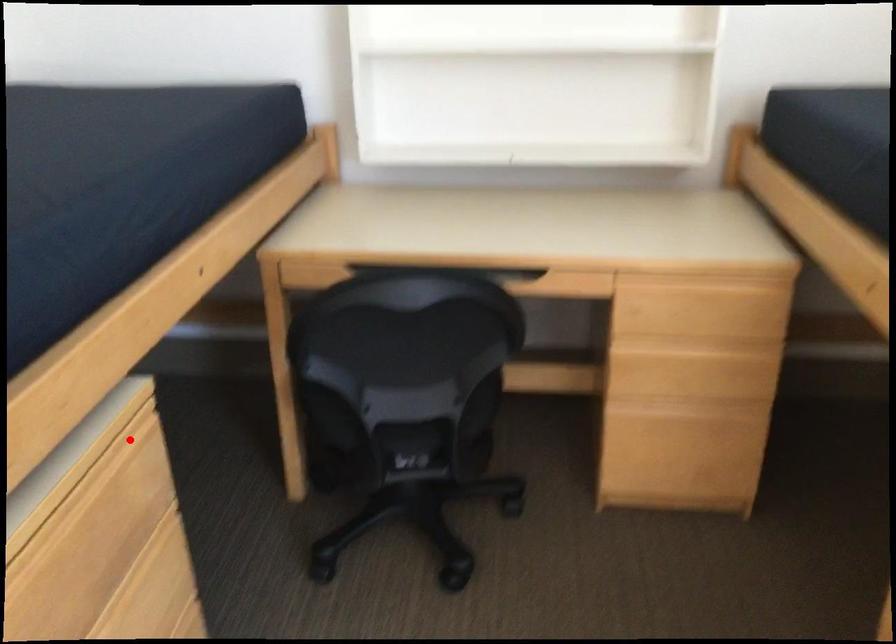
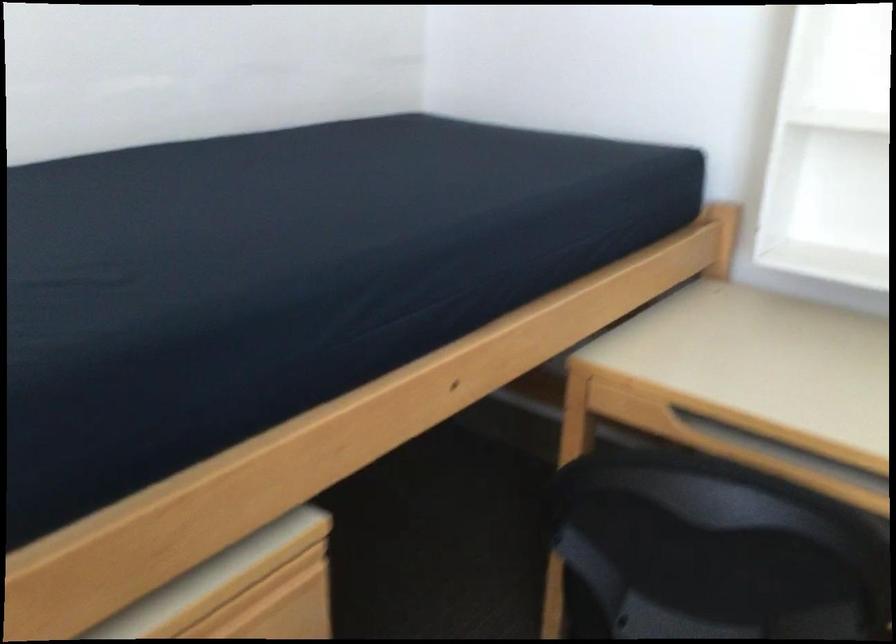
Find the pixel in the second image that matches the highlighted location in the first image.

(277, 581)